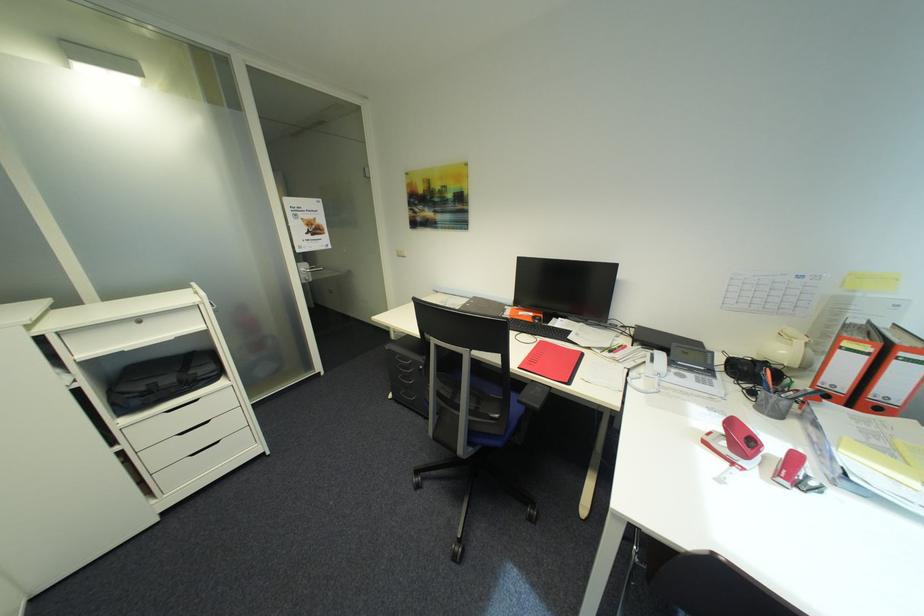
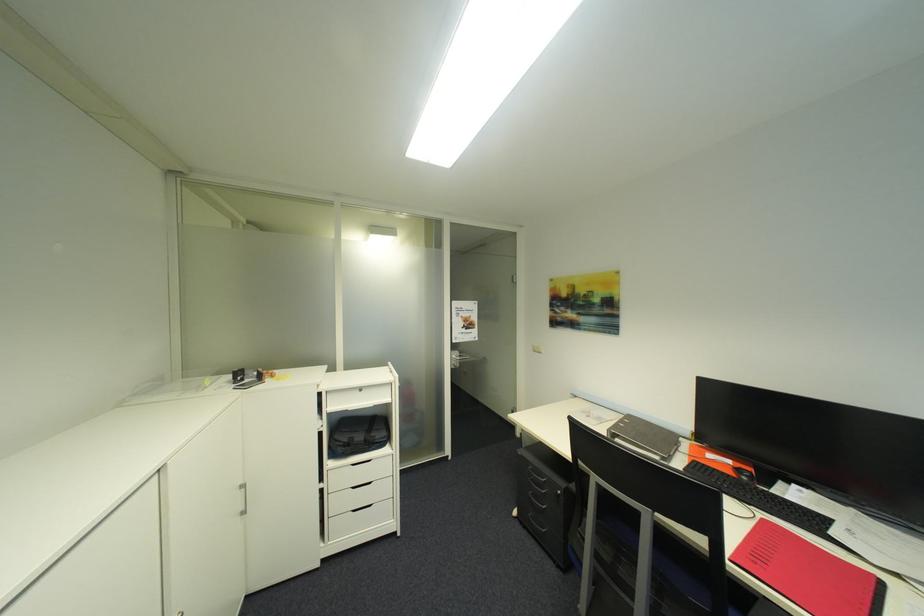
Where in the second image is the point corresponding to the point at 176,407 from the first image?

(362, 461)